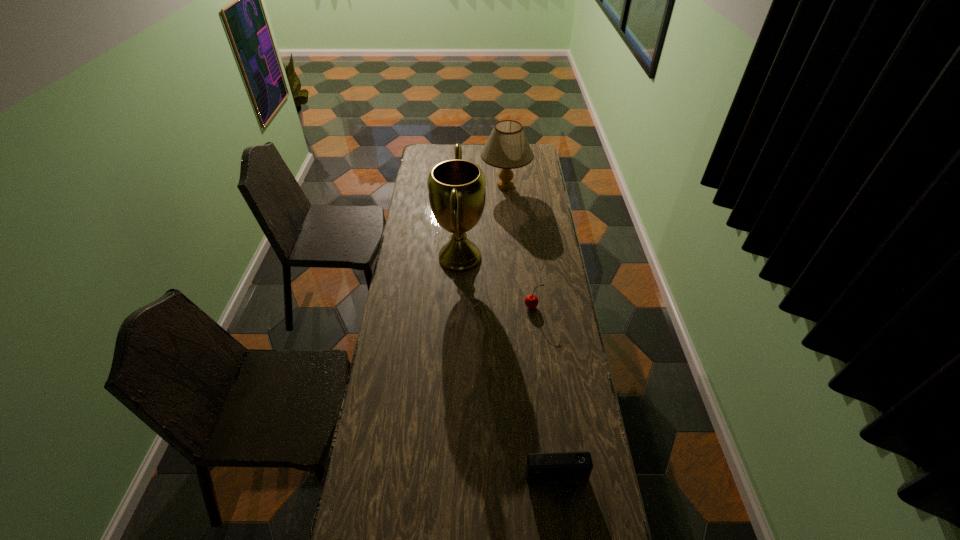
Locate an element on the screen. The image size is (960, 540). trophy cup is located at coordinates (456, 188).

What are the coordinates of `the tallest object` in the screenshot? It's located at (456, 188).

This screenshot has width=960, height=540. Find the location of `the third shortest object`. the third shortest object is located at coordinates (507, 147).

Find the location of a particular element. This screenshot has height=540, width=960. lampshade is located at coordinates (507, 147).

Where is `the nearest object`? the nearest object is located at coordinates (567, 469).

Locate an element on the screen. the third farthest object is located at coordinates (531, 301).

Locate an element on the screen. blank space located 0.350m on the surface of the third nearest object with symbols is located at coordinates (562, 257).

Identify the location of vacant region located 0.240m on the back of the farthest object. Image resolution: width=960 pixels, height=540 pixels. (503, 151).

Locate an element on the screen. vacant space located 0.110m on the front-facing side of the camera is located at coordinates (564, 538).

At what (x,y) coordinates should I click in order to perform the action: click on vacant space located on the back of the third farthest object. Please return your answer as a coordinate pair (x, y). The width and height of the screenshot is (960, 540). Looking at the image, I should click on (525, 242).